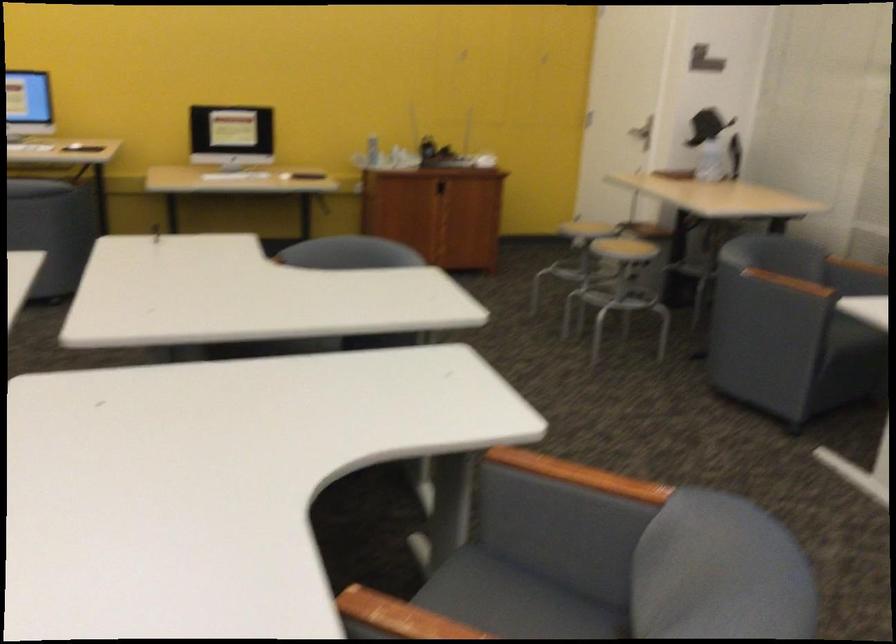
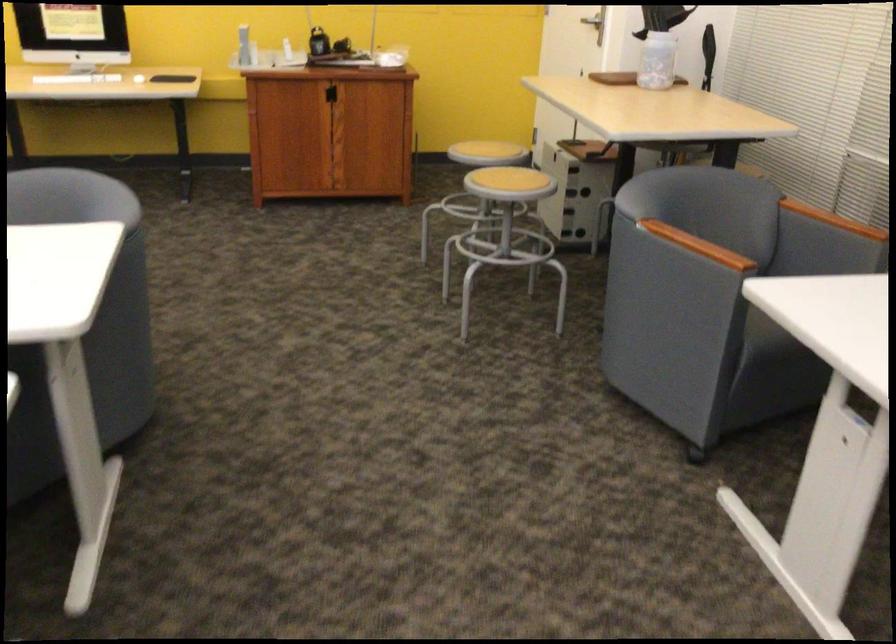
Which direction would the cameraman need to move to produce the second image?

The movement direction of the cameraman is right, forward.